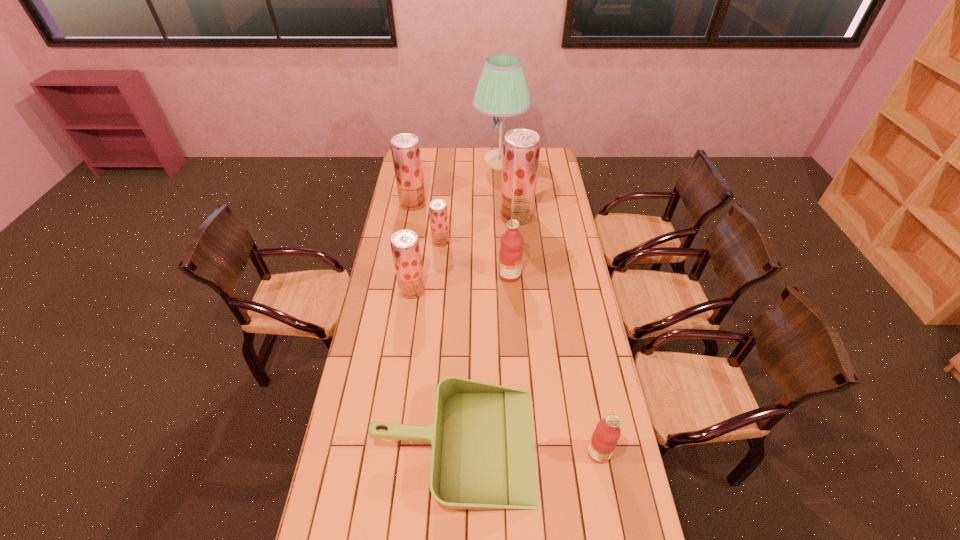
This screenshot has height=540, width=960. Find the location of `vacant region at the far right corner`. vacant region at the far right corner is located at coordinates (546, 155).

At what (x,y) coordinates should I click in order to perform the action: click on empty location between the lamp and the third tallest object. Please return your answer as a coordinate pair (x, y). The image size is (960, 540). Looking at the image, I should click on pyautogui.click(x=456, y=183).

You are a GUI agent. You are given a task and a screenshot of the screen. Output one action in this format:
    pyautogui.click(x=<x>, y=<y>)
    Task: Click on the vacant space that's between the tallest fruit juice and the dustpan
    This screenshot has height=540, width=960.
    Given the screenshot: What is the action you would take?
    pyautogui.click(x=485, y=330)

At what (x,y) coordinates should I click in order to perform the action: click on vacant space in between the dustpan and the farthest object. Please return your answer as a coordinate pair (x, y). The image size is (960, 540). Looking at the image, I should click on (477, 303).

The height and width of the screenshot is (540, 960). Identify the location of blank region between the second smallest strawberry fruit juice and the dustpan. click(433, 367).

Where is `free point between the nearer pink fruit juice and the teal lamp`? The image size is (960, 540). free point between the nearer pink fruit juice and the teal lamp is located at coordinates (549, 307).

The width and height of the screenshot is (960, 540). I want to click on free point between the second smallest strawberry fruit juice and the teal lamp, so click(x=456, y=226).

Locate an element on the screen. unoccupied position between the tallest fruit juice and the shortest object is located at coordinates (485, 330).

Find the location of a particular element. object that is the third closest to the nearer pink fruit juice is located at coordinates (405, 246).

Where is `object that is the sixth closest to the third smallest strawberry fruit juice`? Image resolution: width=960 pixels, height=540 pixels. object that is the sixth closest to the third smallest strawberry fruit juice is located at coordinates (483, 456).